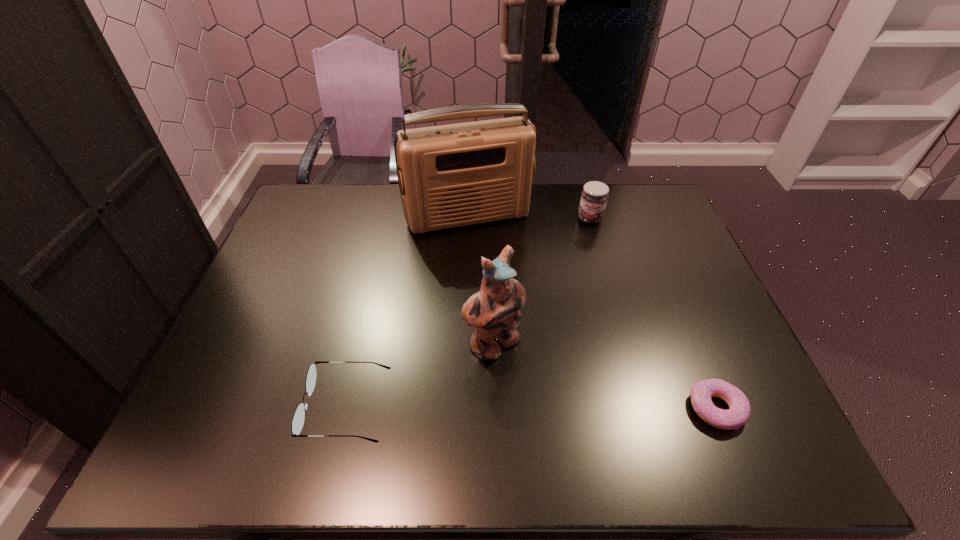
The width and height of the screenshot is (960, 540). Find the location of `the second shortest object`. the second shortest object is located at coordinates (298, 419).

Identify the location of doughnut. (739, 411).

Locate an element on the screen. The image size is (960, 540). the shortest object is located at coordinates (739, 411).

Locate an element on the screen. the second object from right to left is located at coordinates (594, 196).

Locate an element on the screen. the third shortest object is located at coordinates (594, 196).

Locate an element on the screen. This screenshot has width=960, height=540. the tallest object is located at coordinates (454, 175).

Find the location of a particular element. figurine is located at coordinates (493, 312).

Where is `the third farthest object`? This screenshot has width=960, height=540. the third farthest object is located at coordinates click(x=493, y=312).

I want to click on vacant region located on the lenses of the fourth tallest object, so click(195, 407).

Identify the location of vacant area located 0.220m on the lenses of the fourth tallest object. (208, 407).